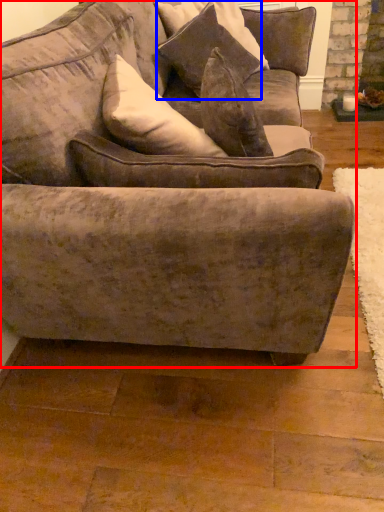
Question: Which of the following is the closest to the observer, studio couch (highlighted by a red box) or pillow (highlighted by a blue box)?

Choices:
 (A) studio couch
 (B) pillow

Answer: (A)